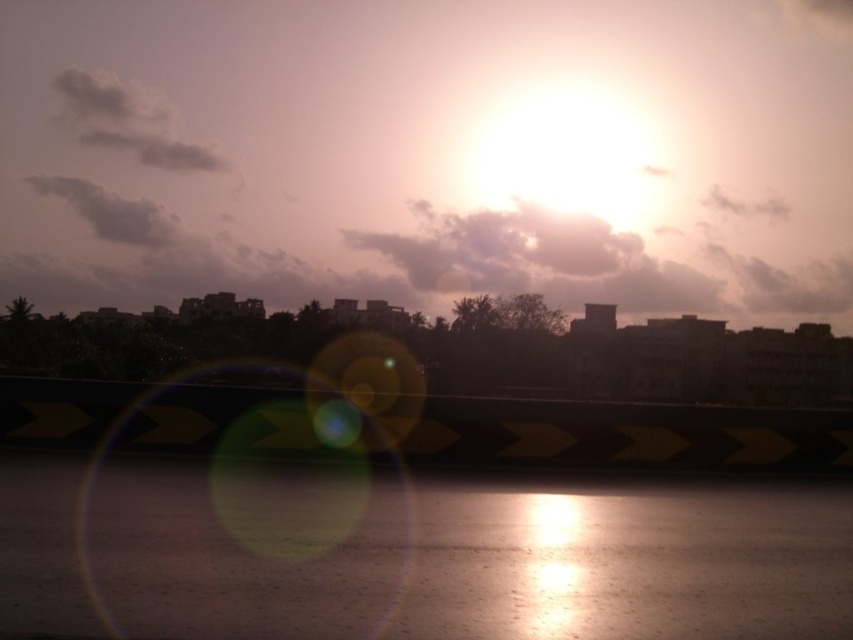
You are standing at the point marked by the coordinate point (630, 435). Looking towards the sun, which direction should you turn to face the yellow and black chevron patterned bridge?

The yellow and black chevron patterned bridge is located in the midground, which is in front of the sun. Since the sun is at the top center, turning to face the bridge would mean facing towards the midground area directly in front of you, so you should turn towards the direction where the bridge is situated, which is in front of the sun. However, since the bridge is part of the midground and the sun is in the top center, the exact direction depends on the bridge placement. The point (630, 435) is at the 6